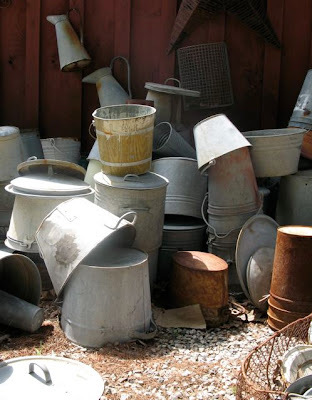
Where is `wicker`? The height and width of the screenshot is (400, 312). wicker is located at coordinates (264, 366).